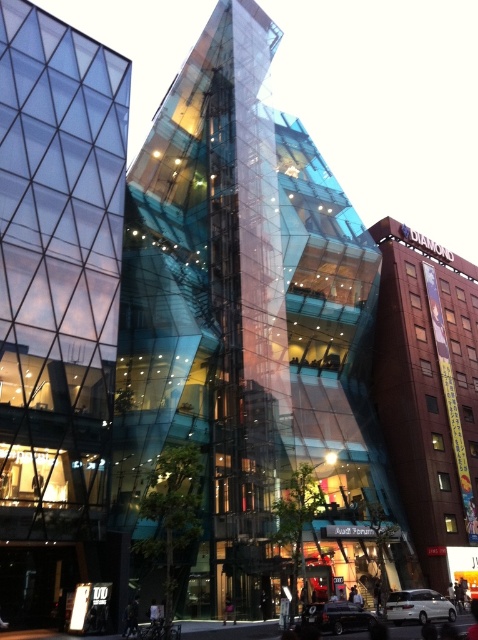
Which is above, white glossy car at lower center or shiny black car at lower center?

shiny black car at lower center is above.

How much distance is there between white glossy car at lower center and shiny black car at lower center?

They are 5.24 meters apart.

Is point (432, 595) positioned before point (350, 609)?

No.

The image size is (478, 640). Identify the location of white glossy car at lower center. (419, 605).